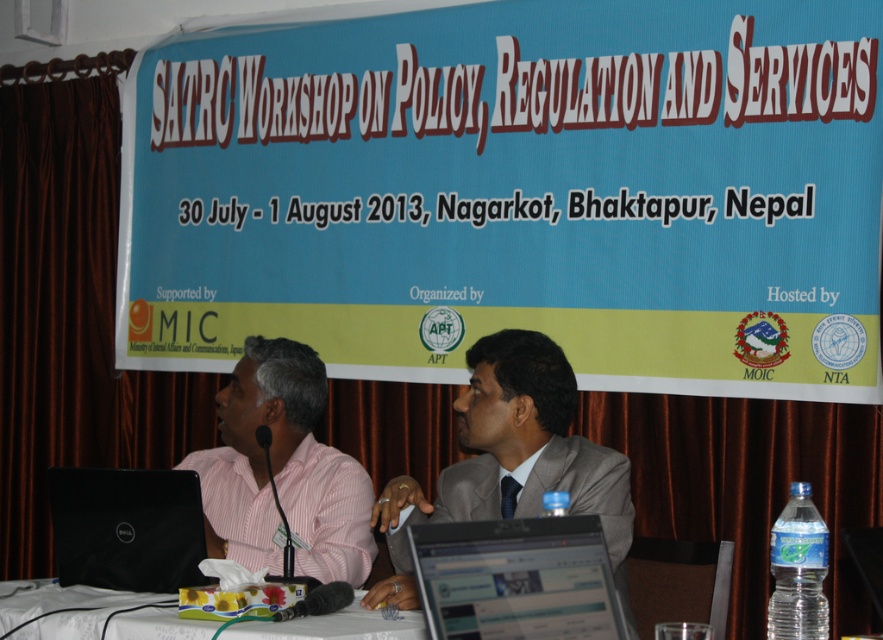
Which is behind, point (711, 48) or point (263, 400)?

Positioned behind is point (711, 48).

The height and width of the screenshot is (640, 883). In order to click on blue fabric banner at upper center in this screenshot , I will do `click(517, 193)`.

Is point (476, 218) less distant than point (263, 540)?

No, it is not.

Find the location of a particular element. blue fabric banner at upper center is located at coordinates (517, 193).

Consider the image. Measure the distance between point (527, 429) and camera.

Point (527, 429) is 8.95 feet from camera.

Does light brown suit at center have a greater width compared to pink striped shirt at left?

Result: Yes.

At what (x,y) coordinates should I click in order to perform the action: click on light brown suit at center. Please return your answer as a coordinate pair (x, y). The image size is (883, 640). Looking at the image, I should click on (511, 460).

This screenshot has width=883, height=640. Find the location of `light brown suit at center`. light brown suit at center is located at coordinates (511, 460).

Looking at this image, does light brown suit at center appear on the right side of black matte laptop at left?

Yes, light brown suit at center is to the right of black matte laptop at left.

Which is more to the right, light brown suit at center or black matte laptop at left?

light brown suit at center

Where is `light brown suit at center`? This screenshot has width=883, height=640. light brown suit at center is located at coordinates (511, 460).

This screenshot has height=640, width=883. Find the location of `light brown suit at center`. light brown suit at center is located at coordinates (511, 460).